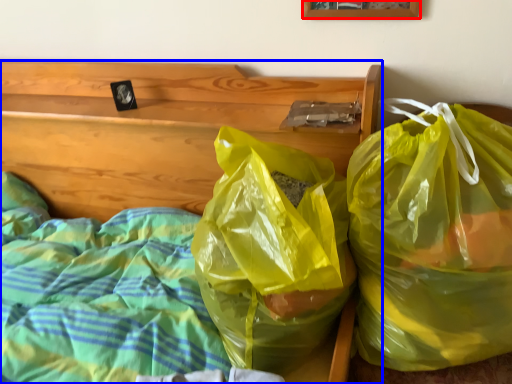
Question: Which object is further to the camera taking this photo, picture frame (highlighted by a red box) or furniture (highlighted by a blue box)?

Choices:
 (A) picture frame
 (B) furniture

Answer: (A)